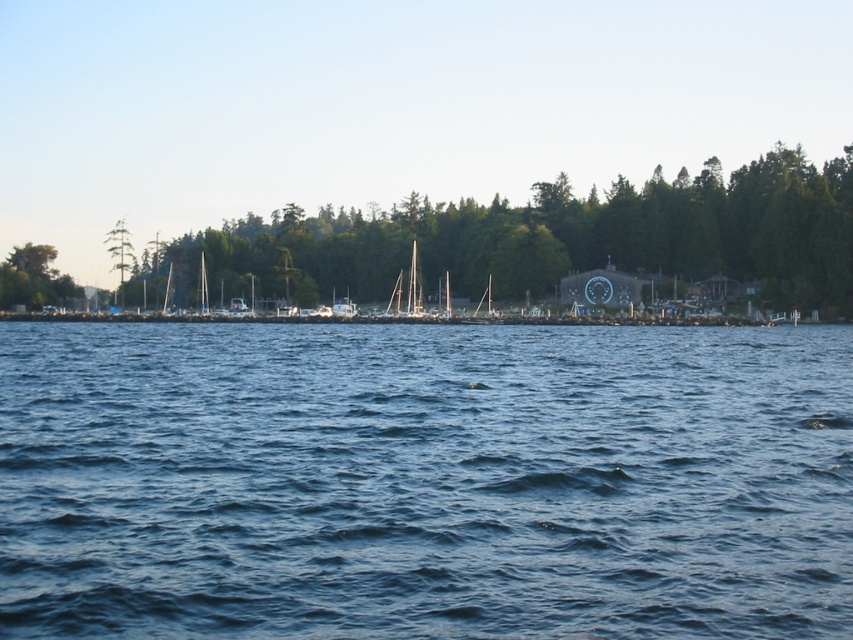
Question: Does blue water at center have a larger size compared to green leafy trees at center?

Choices:
 (A) yes
 (B) no

Answer: (B)

Question: Observing the image, what is the correct spatial positioning of green leafy tree at left in reference to white matte sailboat at center?

Choices:
 (A) below
 (B) above

Answer: (B)

Question: Which point is closer to the camera taking this photo?

Choices:
 (A) (77, 292)
 (B) (461, 456)

Answer: (B)

Question: Which is farther from the blue water at center?

Choices:
 (A) white matte sailboat at center
 (B) green leafy trees at center
 (C) green leafy tree at left

Answer: (C)

Question: Which point is farther from the camera taking this photo?

Choices:
 (A) (337, 316)
 (B) (341, 257)
 (C) (425, 550)

Answer: (B)

Question: Does green leafy tree at left appear over white matte sailboat at center?

Choices:
 (A) no
 (B) yes

Answer: (B)